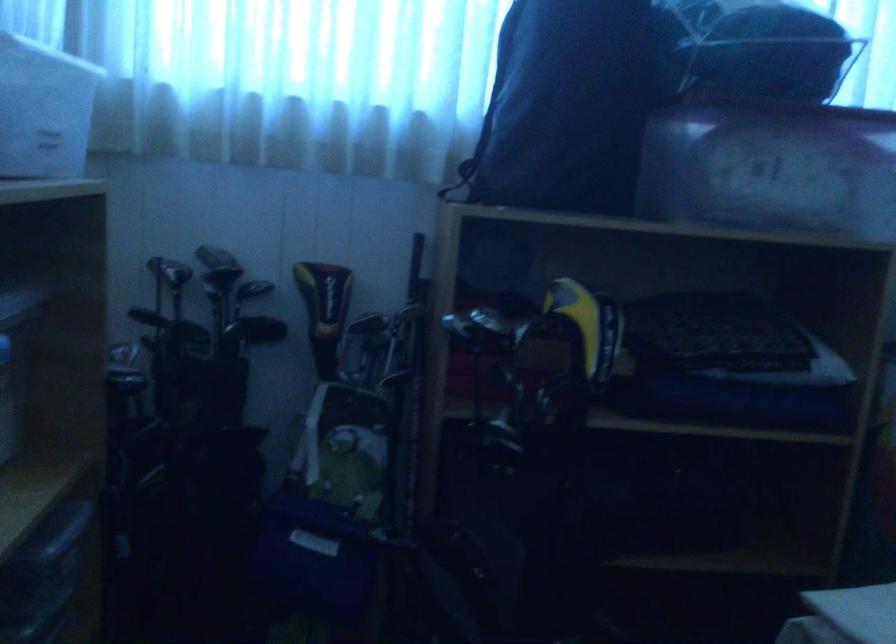
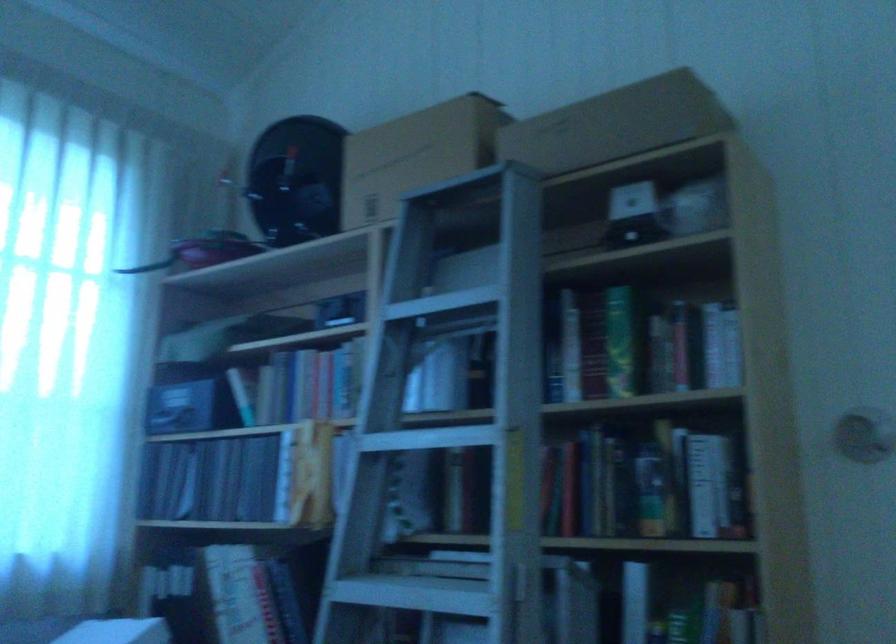
First-person continuous shooting, in which direction is the camera rotating?

The rotation direction of the camera is right-up.